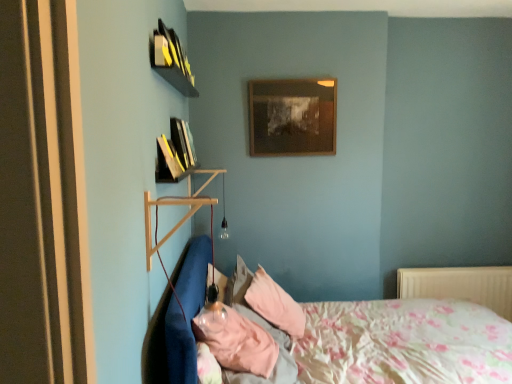
Question: From a real-world perspective, is white plastic radiator at lower right on hardcover books at upper left, which is counted as the first book, starting from the front?

Choices:
 (A) no
 (B) yes

Answer: (A)

Question: From the image's perspective, is white plastic radiator at lower right under hardcover books at upper left, which is counted as the first book, starting from the front?

Choices:
 (A) no
 (B) yes

Answer: (B)

Question: Would you say hardcover books at upper left, the 2th book viewed from the back, is part of white plastic radiator at lower right's contents?

Choices:
 (A) no
 (B) yes

Answer: (A)

Question: Is white plastic radiator at lower right outside hardcover books at upper left, the 2th book viewed from the back?

Choices:
 (A) no
 (B) yes

Answer: (B)

Question: From a real-world perspective, does white plastic radiator at lower right sit lower than hardcover books at upper left, the 2th book viewed from the back?

Choices:
 (A) yes
 (B) no

Answer: (A)

Question: Is white plastic radiator at lower right positioned with its back to hardcover books at upper left, the 2th book viewed from the back?

Choices:
 (A) no
 (B) yes

Answer: (A)

Question: Considering the relative sizes of white plastic radiator at lower right and pink fabric pillow at lower center in the image provided, is white plastic radiator at lower right shorter than pink fabric pillow at lower center?

Choices:
 (A) no
 (B) yes

Answer: (A)

Question: Considering the relative positions of white plastic radiator at lower right and pink fabric pillow at lower center in the image provided, is white plastic radiator at lower right to the right of pink fabric pillow at lower center from the viewer's perspective?

Choices:
 (A) no
 (B) yes

Answer: (B)

Question: Can you see white plastic radiator at lower right touching pink fabric pillow at lower center?

Choices:
 (A) no
 (B) yes

Answer: (A)

Question: Can you confirm if white plastic radiator at lower right is smaller than pink fabric pillow at lower center?

Choices:
 (A) yes
 (B) no

Answer: (A)

Question: Is white plastic radiator at lower right positioned before pink fabric pillow at lower center?

Choices:
 (A) yes
 (B) no

Answer: (B)

Question: Does white plastic radiator at lower right lie behind pink fabric pillow at lower center?

Choices:
 (A) yes
 (B) no

Answer: (A)

Question: Is wooden picture frame at upper center outside floral fabric bed at lower right?

Choices:
 (A) yes
 (B) no

Answer: (A)